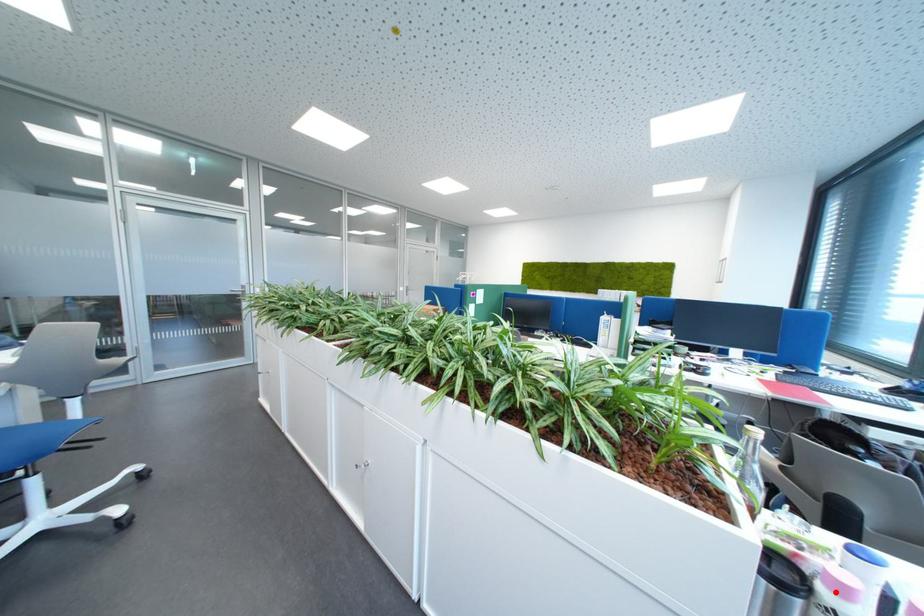
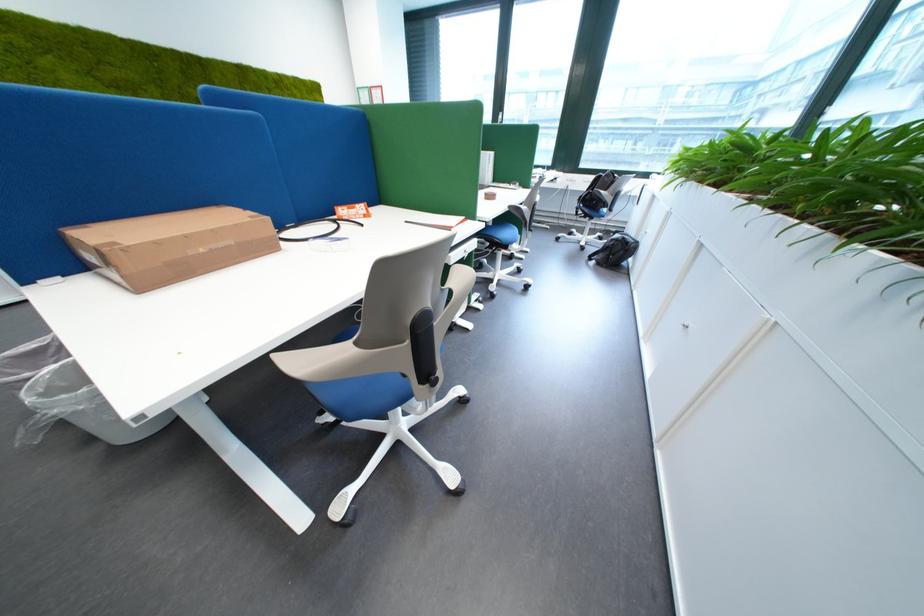
Question: I am providing you with two images of the same scene from different viewpoints. A red point is marked on the first image. Is the red point's position out of view in image 2?

Choices:
 (A) Yes
 (B) No

Answer: (A)